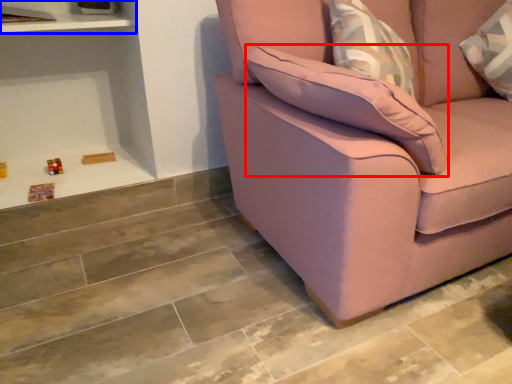
Question: Which object appears closest to the camera in this image, pillow (highlighted by a red box) or shelf (highlighted by a blue box)?

Choices:
 (A) pillow
 (B) shelf

Answer: (A)